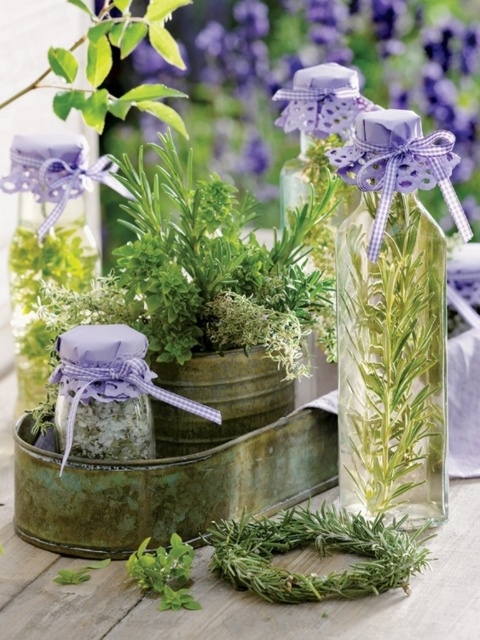
Is matte purple glass bottle at upper center above clear glass vase at center?

Indeed, matte purple glass bottle at upper center is positioned over clear glass vase at center.

What do you see at coordinates (315, 61) in the screenshot? I see `matte purple glass bottle at upper center` at bounding box center [315, 61].

Who is more distant from viewer, (x=169, y=67) or (x=365, y=477)?

Positioned behind is point (x=169, y=67).

Locate an element on the screen. The height and width of the screenshot is (640, 480). matte purple glass bottle at upper center is located at coordinates (315, 61).